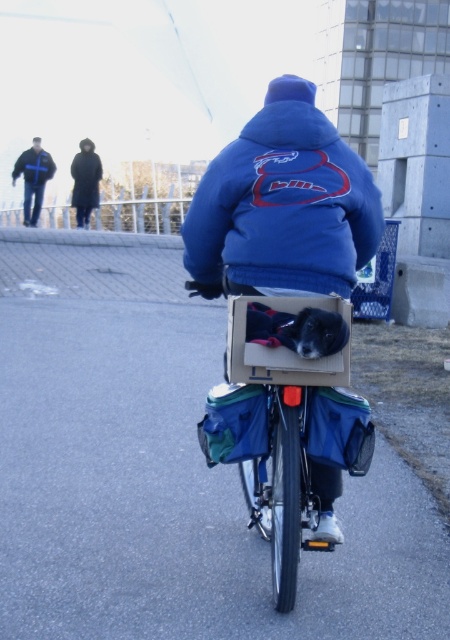
From the picture: Between blue fleece jacket at center and cardboard box at center, which one is positioned higher?

blue fleece jacket at center

Does blue fleece jacket at center have a greater height compared to cardboard box at center?

Incorrect, blue fleece jacket at center's height is not larger of cardboard box at center's.

Between point (341, 150) and point (301, 540), which one is positioned in front?

Point (301, 540) is more forward.

You are a GUI agent. You are given a task and a screenshot of the screen. Output one action in this format:
    pyautogui.click(x=<x>, y=<y>)
    Task: Click on the blue fleece jacket at center
    This screenshot has width=450, height=640.
    Given the screenshot: What is the action you would take?
    pyautogui.click(x=283, y=205)

Is point (309, 147) positioned behind point (94, 195)?

No, (309, 147) is in front of (94, 195).

Who is more forward, (328, 227) or (79, 144)?

Point (328, 227) is more forward.

I want to click on blue fleece jacket at center, so click(x=283, y=205).

Does black matte jacket at upper left appear on the left side of blue fleece jacket at upper left?

No, black matte jacket at upper left is not to the left of blue fleece jacket at upper left.

Is point (86, 170) farther from camera compared to point (28, 148)?

No.

The height and width of the screenshot is (640, 450). What are the coordinates of `black matte jacket at upper left` in the screenshot? It's located at (85, 177).